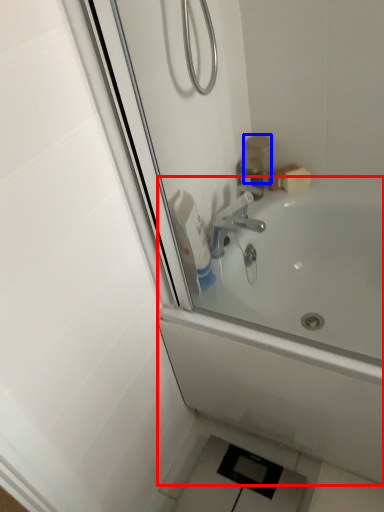
Question: Among these objects, which one is nearest to the camera, bathtub (highlighted by a red box) or toiletry (highlighted by a blue box)?

Choices:
 (A) bathtub
 (B) toiletry

Answer: (A)